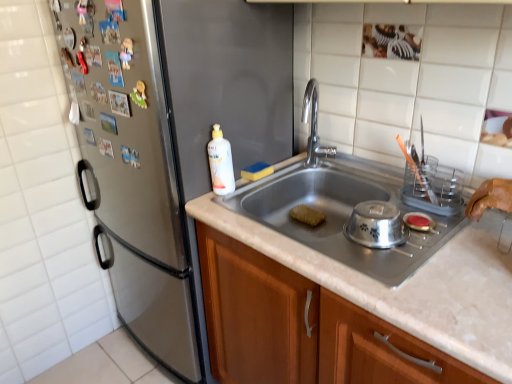
Identify the location of free point to the left of polished stainless steel faucet at center. This screenshot has height=384, width=512. (274, 177).